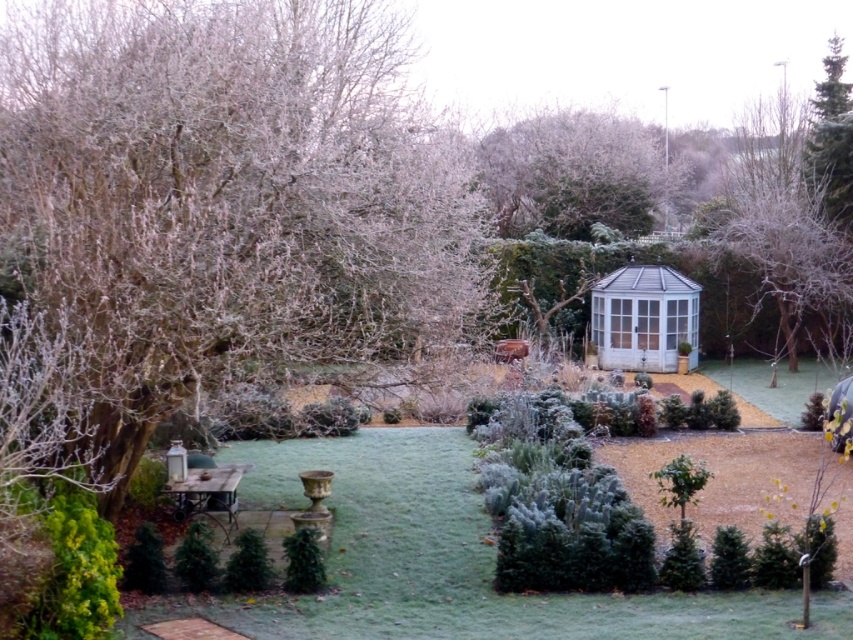
You are standing at the entrance of the winter garden and see two points marked in the scene. The first point is at coordinates point (x=236, y=324) and the second point is at point (x=308, y=548). Which point is closer to you?

Point (x=236, y=324) is in front of point (x=308, y=548), so it is closer to you.